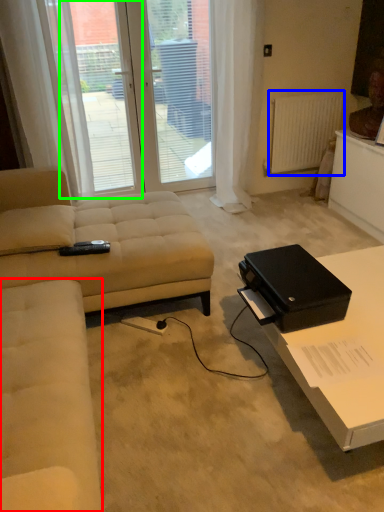
Question: Estimate the real-world distances between objects in this image. Which object is closer to couch (highlighted by a red box), radiator (highlighted by a blue box) or window screen (highlighted by a green box)?

Choices:
 (A) radiator
 (B) window screen

Answer: (B)